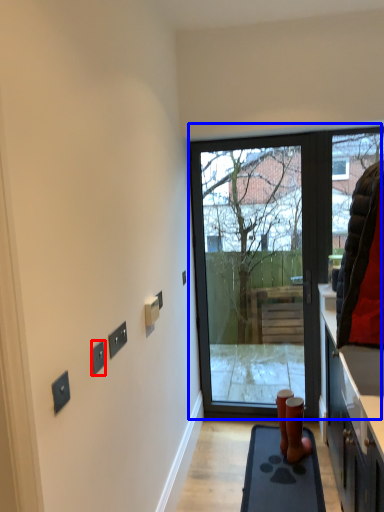
Question: Which point is further to the camera, electric outlet (highlighted by a red box) or door (highlighted by a blue box)?

Choices:
 (A) electric outlet
 (B) door

Answer: (B)